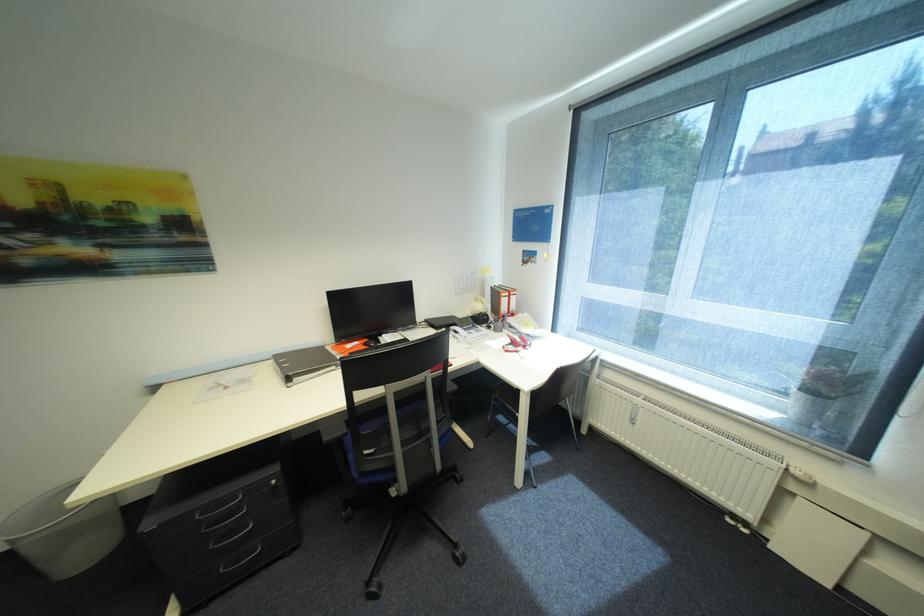
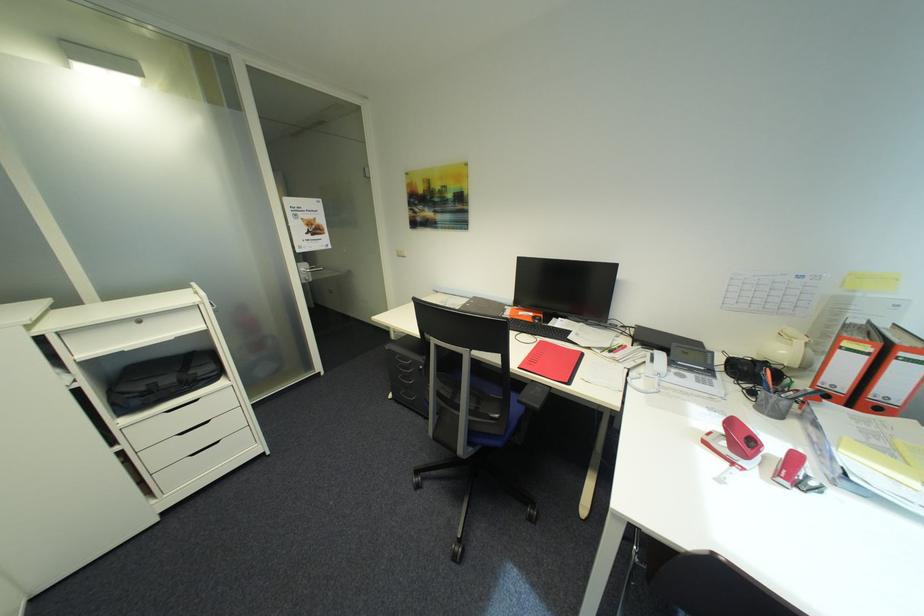
The point at (x=525, y=352) is marked in the first image. Where is the corresponding point in the second image?

(742, 464)